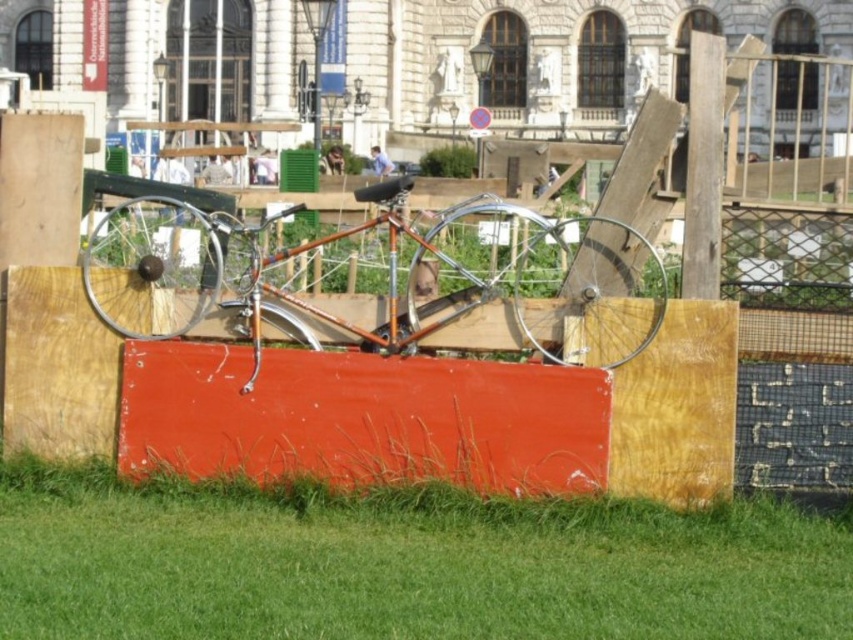
You are standing at the edge of the scene and want to walk towards the shiny orange bicycle at center. Which direction should you move relative to the green grass at lower center?

You should move to the left of the green grass at lower center because the shiny orange bicycle at center is to the left of it.

You are standing in front of the red rectangular object with the bicycle on top. There are two points marked on the ground around it. One is at point coordinates point (6, 476) and the other is at point coordinates point (582, 246). If you want to place a small flag closer to the viewer, which point should you choose?

You should choose point (6, 476) because it is closer to the viewer than point (582, 246).